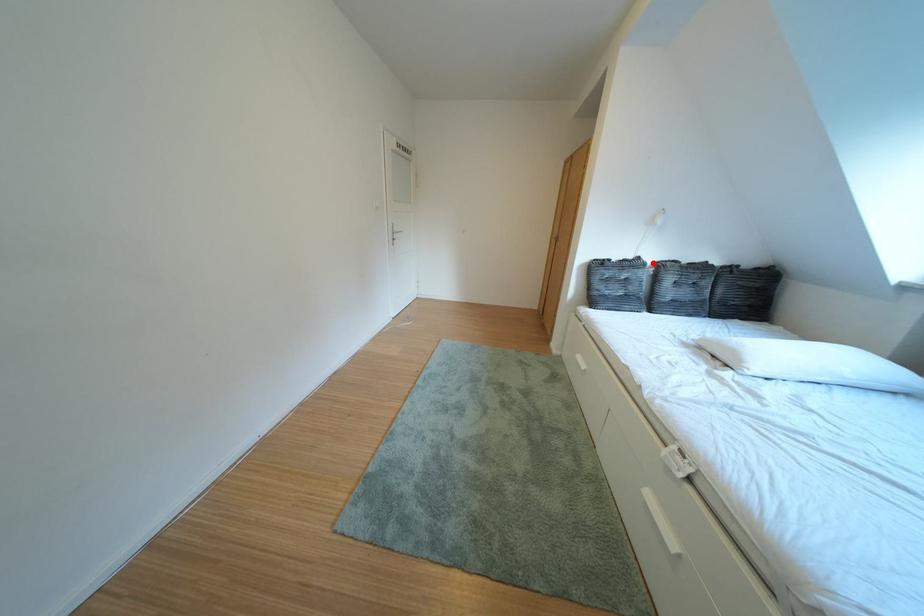
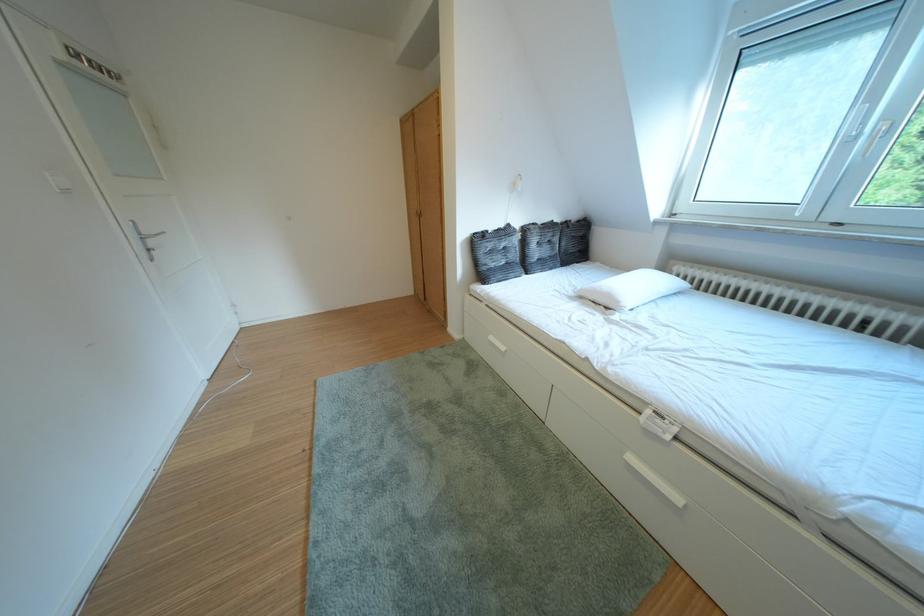
Find the pixel in the second image that matches the highlighted location in the first image.

(523, 230)